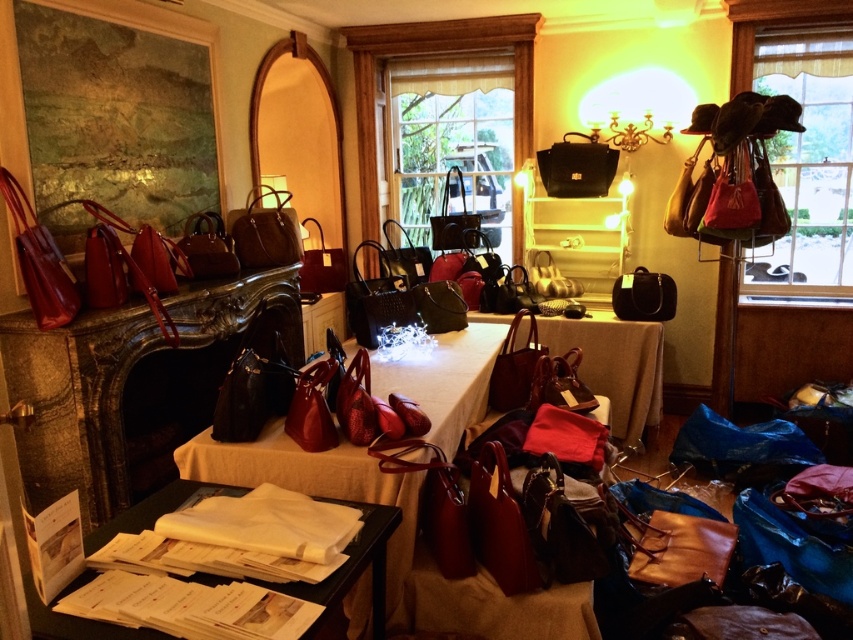
Question: Which point appears closest to the camera in this image?

Choices:
 (A) (630, 413)
 (B) (144, 372)
 (C) (99, 621)
 (D) (308, 486)

Answer: (C)

Question: Does shiny leather handbags at center come in front of white paper at lower left?

Choices:
 (A) no
 (B) yes

Answer: (A)

Question: Among these points, which one is nearest to the camera?

Choices:
 (A) (45, 428)
 (B) (183, 579)
 (C) (312, 465)

Answer: (B)

Question: Is shiny dark brown fireplace at left closer to camera compared to white paper at lower left?

Choices:
 (A) yes
 (B) no

Answer: (B)

Question: Where is shiny dark brown fireplace at left located in relation to matte black handbag at upper center in the image?

Choices:
 (A) above
 (B) below

Answer: (B)

Question: Among these objects, which one is nearest to the camera?

Choices:
 (A) shiny leather handbags at center
 (B) matte leather handbag at center

Answer: (A)